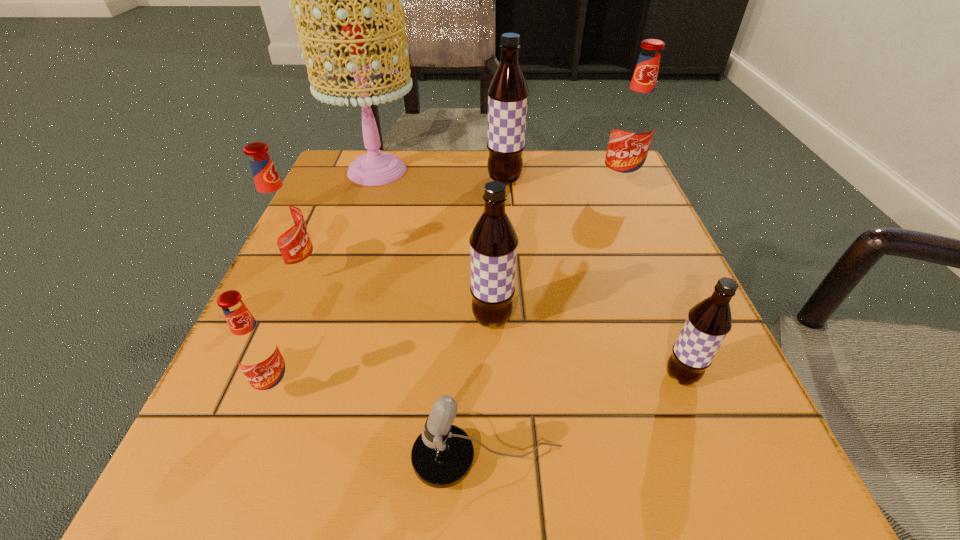
At what (x,y) coordinates should I click in order to perform the action: click on the nearest brown root beer. Please return your answer as a coordinate pair (x, y). Looking at the image, I should click on (708, 322).

Identify the location of the shortest object. The height and width of the screenshot is (540, 960). (442, 456).

Locate an element on the screen. This screenshot has width=960, height=540. white microphone is located at coordinates (442, 456).

In order to click on vacant space positioned on the front of the tallest object in this screenshot , I will do `click(342, 275)`.

Where is `vacant space located on the left of the biggest red root beer`? Image resolution: width=960 pixels, height=540 pixels. vacant space located on the left of the biggest red root beer is located at coordinates pyautogui.click(x=478, y=188).

I want to click on free space located on the right of the farthest brown root beer, so click(x=589, y=179).

Locate an element on the screen. The height and width of the screenshot is (540, 960). vacant space located on the right of the second farthest red root beer is located at coordinates (433, 273).

This screenshot has height=540, width=960. Find the location of `free location located on the right of the fourth farthest root beer`. free location located on the right of the fourth farthest root beer is located at coordinates (653, 319).

At what (x,y) coordinates should I click in order to perform the action: click on free space located 0.300m on the back of the smallest red root beer. Please return your answer as a coordinate pair (x, y). Image resolution: width=960 pixels, height=540 pixels. Looking at the image, I should click on (334, 241).

Where is `vacant space positioned 0.080m on the front of the nearest brown root beer`? The height and width of the screenshot is (540, 960). vacant space positioned 0.080m on the front of the nearest brown root beer is located at coordinates (709, 448).